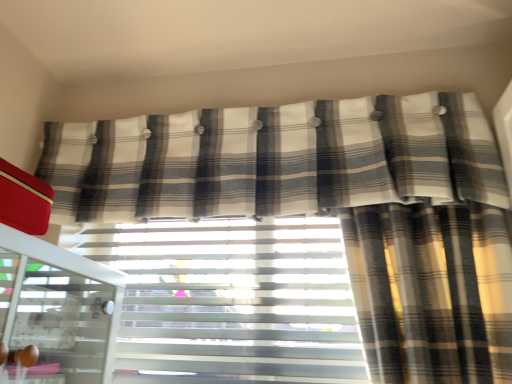
Question: Based on their positions, is white glossy screen door at left located to the left or right of plaid fabric curtain at upper center?

Choices:
 (A) left
 (B) right

Answer: (A)

Question: From a real-world perspective, relative to plaid fabric curtain at upper center, is white glossy screen door at left vertically above or below?

Choices:
 (A) below
 (B) above

Answer: (A)

Question: Estimate the real-world distances between objects in this image. Which object is farther from the white glossy screen door at left?

Choices:
 (A) white textured blinds at center
 (B) plaid fabric curtain at upper center

Answer: (B)

Question: Estimate the real-world distances between objects in this image. Which object is closer to the white glossy screen door at left?

Choices:
 (A) white textured blinds at center
 (B) plaid fabric curtain at upper center

Answer: (A)